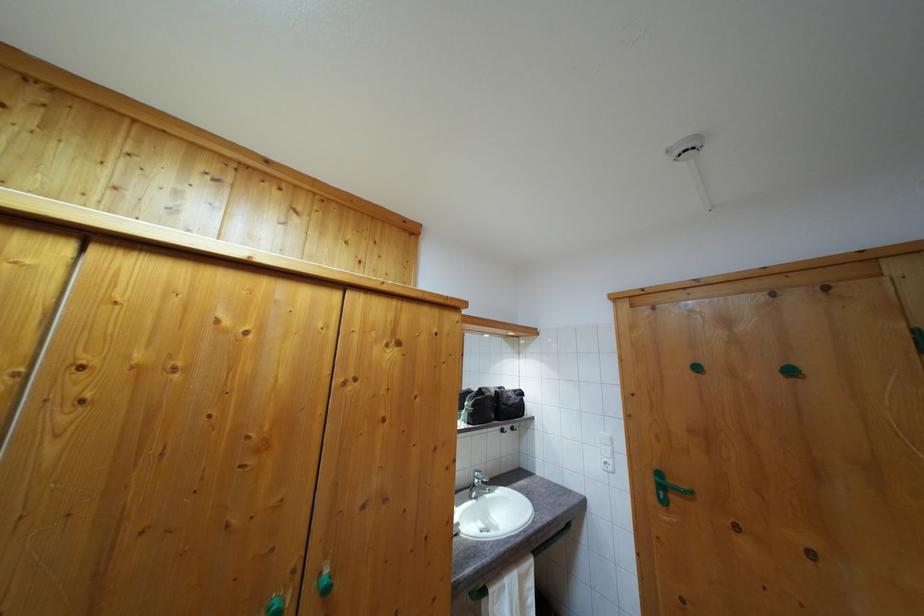
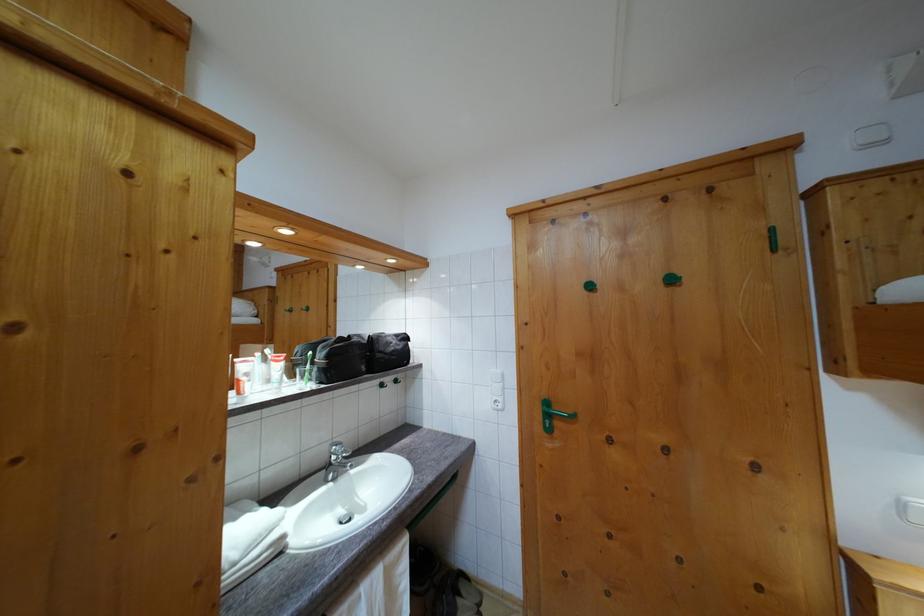
Find the pixel in the second image that matches pixel 662 480 in the first image.

(551, 410)